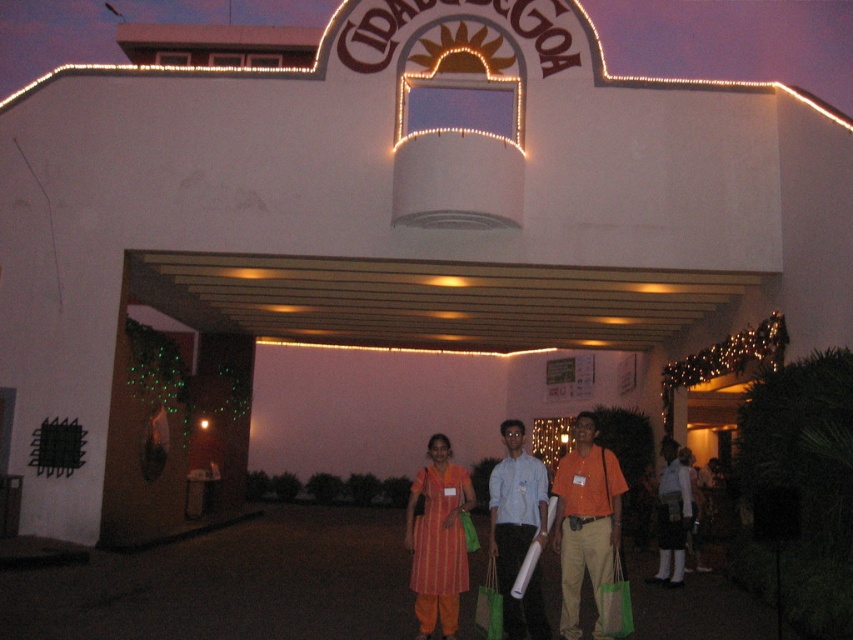
Question: Which point is farther from the camera taking this photo?

Choices:
 (A) (466, 588)
 (B) (570, 556)

Answer: (B)

Question: Which object appears closest to the camera in this image?

Choices:
 (A) orange cotton shirt at center
 (B) orange striped dress at center
 (C) green mesh bag at center
 (D) light blue cotton shirt at center

Answer: (D)

Question: Among these objects, which one is nearest to the camera?

Choices:
 (A) orange cotton shirt at center
 (B) green mesh bag at center
 (C) green fabric bag at center
 (D) orange striped dress at center

Answer: (C)

Question: Does matte orange dress at center lie in front of green fabric bag at center?

Choices:
 (A) yes
 (B) no

Answer: (B)

Question: Does orange striped dress at center lie behind green fabric bag at center?

Choices:
 (A) no
 (B) yes

Answer: (B)

Question: Considering the relative positions of light blue cotton shirt at center and orange striped dress at center in the image provided, where is light blue cotton shirt at center located with respect to orange striped dress at center?

Choices:
 (A) left
 (B) right

Answer: (A)